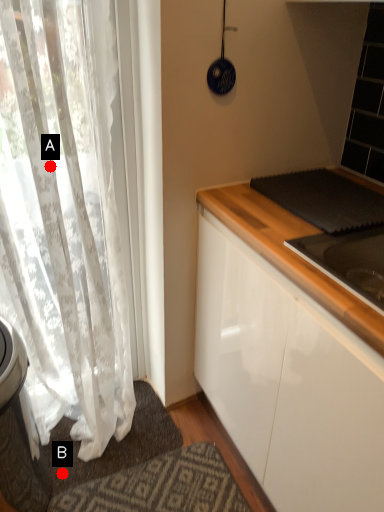
Question: Two points are circled on the image, labeled by A and B beside each circle. Among these points, which one is nearest to the camera?

Choices:
 (A) A is closer
 (B) B is closer

Answer: (A)